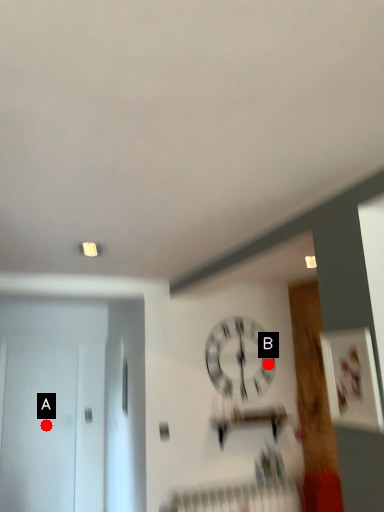
Question: Two points are circled on the image, labeled by A and B beside each circle. Which point is farther from the camera taking this photo?

Choices:
 (A) A is further
 (B) B is further

Answer: (A)